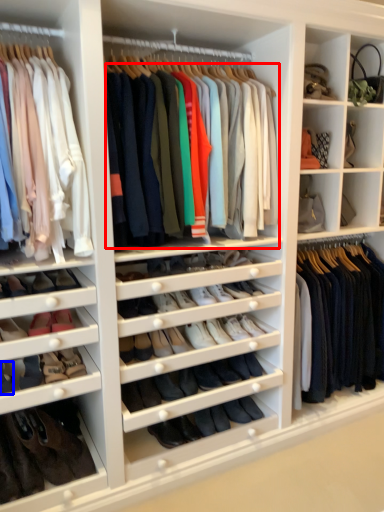
Question: Which object appears closest to the camera in this image, clothing (highlighted by a red box) or shoe (highlighted by a blue box)?

Choices:
 (A) clothing
 (B) shoe

Answer: (A)